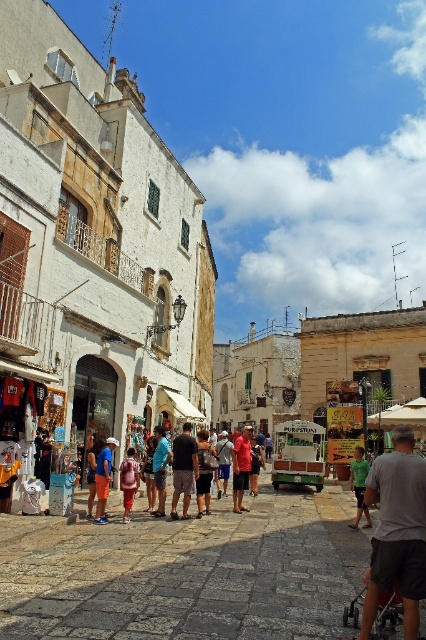
Consider the image. You are a tourist walking down the street and see the gray fabric stroller at lower right and the red shirt at center. Which object is positioned higher up in the image?

The gray fabric stroller at lower right is located above the red shirt at center in the image.

You are a tourist standing on the street and you see two people wearing the green cotton shirt at center and the red shirt at center. Which person is shorter?

The green cotton shirt at center has a lesser height compared to red shirt at center, so the person wearing the green cotton shirt at center is shorter.

You are a customer at the Puro Stufi food truck and you want to buy the taller pair of shorts between the orange cotton shorts at center and the denim shorts at center. Which one should you choose?

The orange cotton shorts at center has a greater height compared to denim shorts at center, so you should choose the orange cotton shorts at center.